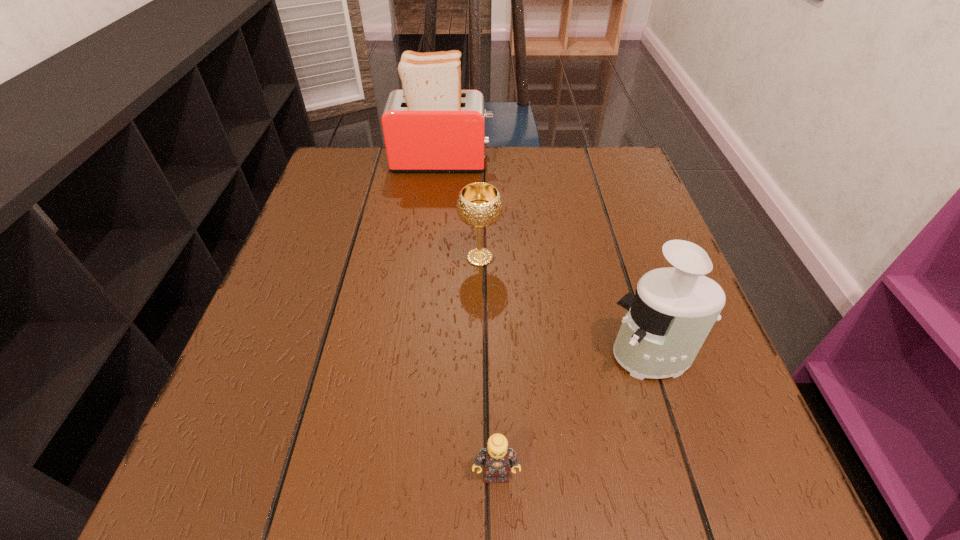
This screenshot has height=540, width=960. Identify the location of object that is at the far edge. (431, 125).

Image resolution: width=960 pixels, height=540 pixels. I want to click on object positioned at the near edge, so click(497, 458).

You are a GUI agent. You are given a task and a screenshot of the screen. Output one action in this format:
    pyautogui.click(x=<x>, y=<y>)
    Task: Click on the object that is at the right edge
    
    Given the screenshot: What is the action you would take?
    pyautogui.click(x=667, y=321)

At what (x,y) coordinates should I click in order to perform the action: click on vacant space at the far edge of the desktop. Please return your answer as a coordinate pair (x, y). This screenshot has width=960, height=540. Looking at the image, I should click on [388, 197].

In the image, there is a desktop. Where is `vacant space at the near edge`? The height and width of the screenshot is (540, 960). vacant space at the near edge is located at coordinates (339, 498).

Where is `vacant position at the left edge of the desktop`? The image size is (960, 540). vacant position at the left edge of the desktop is located at coordinates (309, 376).

You are a GUI agent. You are given a task and a screenshot of the screen. Output one action in this format:
    pyautogui.click(x=<x>, y=<y>)
    Task: Click on the vacant area at the right edge of the desktop
    
    Given the screenshot: What is the action you would take?
    pyautogui.click(x=736, y=442)

Locate an element on the screen. This screenshot has height=540, width=960. free space at the far right corner is located at coordinates (579, 197).

The image size is (960, 540). In the image, there is a desktop. What are the coordinates of `vacant region at the near right corner` in the screenshot? It's located at (657, 457).

I want to click on free space between the shortest object and the second farthest object, so click(x=488, y=366).